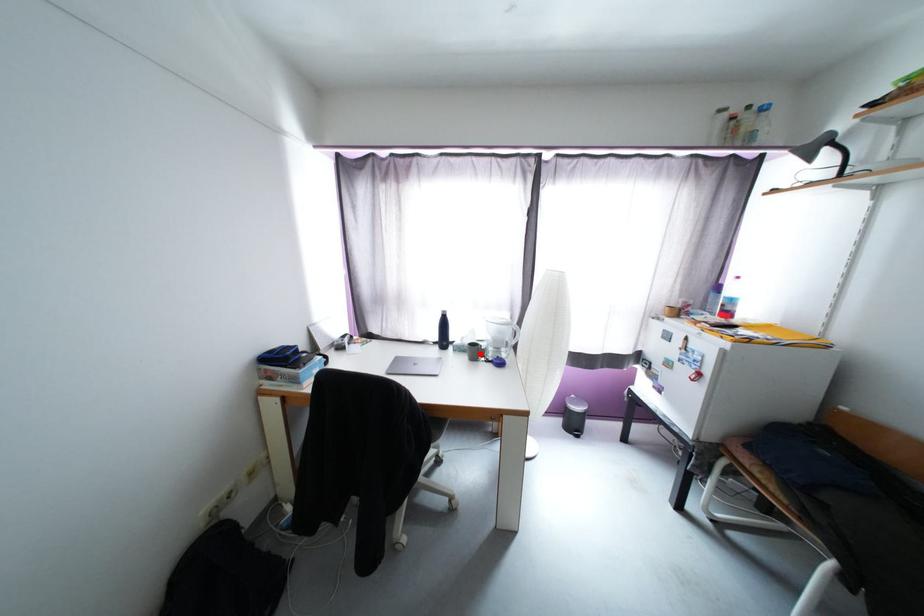
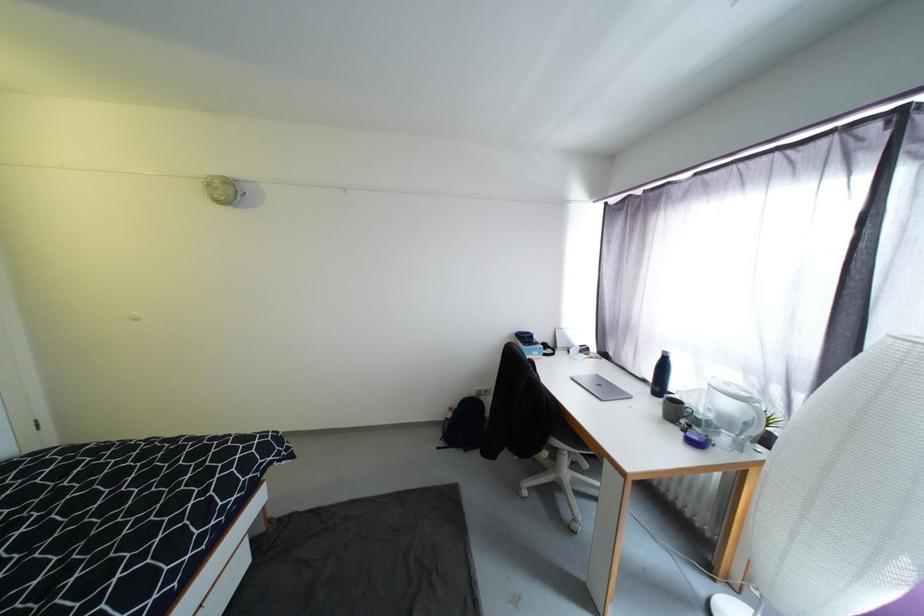
Question: I am providing you with two images of the same scene from different viewpoints. Given a red point in image1, look at the same physical point in image2. Is it:

Choices:
 (A) Closer to the viewpoint
 (B) Farther from the viewpoint

Answer: (A)